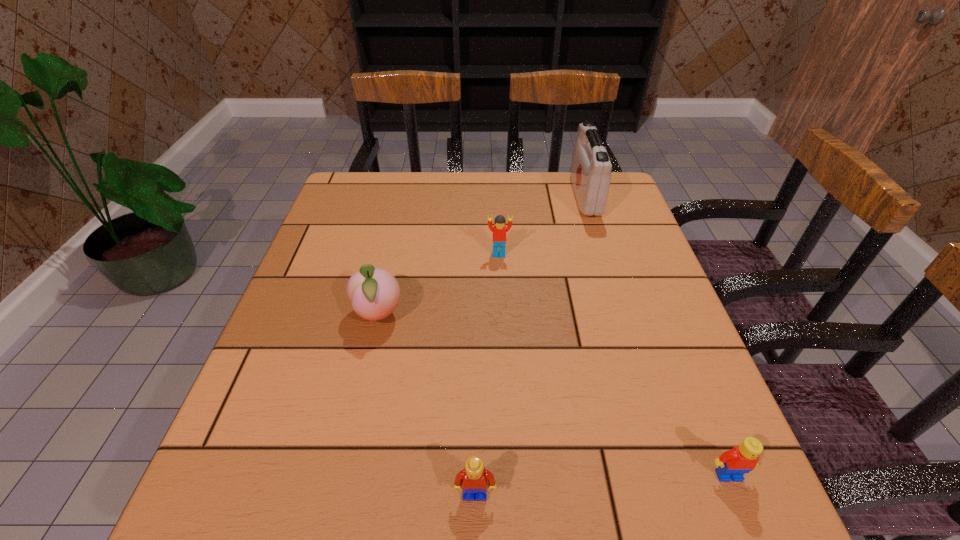
The width and height of the screenshot is (960, 540). What are the coordinates of `vacant area that lies between the nearest Lego and the rightmost Lego` in the screenshot? It's located at (602, 484).

The width and height of the screenshot is (960, 540). Find the location of `unoccupied position between the second nearest Lego and the peach`. unoccupied position between the second nearest Lego and the peach is located at coordinates (553, 395).

Find the location of a particular element. The height and width of the screenshot is (540, 960). vacant area between the third farthest object and the nearest object is located at coordinates (426, 404).

Find the location of `unoccupied area between the leftmost object and the nearest Lego`. unoccupied area between the leftmost object and the nearest Lego is located at coordinates (426, 404).

Find the location of `free point between the nearest Lego and the third farthest object`. free point between the nearest Lego and the third farthest object is located at coordinates (426, 404).

Point out which object is positioned as the fourth nearest to the second farthest Lego. Please provide its 2D coordinates. Your answer should be formatted as a tuple, i.e. [(x, y)], where the tuple contains the x and y coordinates of a point satisfying the conditions above.

[(591, 168)]

Find the location of a particular element. This screenshot has width=960, height=540. object identified as the fourth closest to the nearest object is located at coordinates (591, 168).

At what (x,y) coordinates should I click in order to perform the action: click on the third closest Lego relative to the farthest object. Please return your answer as a coordinate pair (x, y). Looking at the image, I should click on (474, 478).

Point out which Lego is positioned as the nearest to the farthest Lego. Please provide its 2D coordinates. Your answer should be formatted as a tuple, i.e. [(x, y)], where the tuple contains the x and y coordinates of a point satisfying the conditions above.

[(474, 478)]

At what (x,y) coordinates should I click in order to perform the action: click on vacant space that satisfies the following two spatial constraints: 1. on the front side of the first-aid kit; 2. on the face of the second farthest object. Please return your answer as a coordinate pair (x, y). This screenshot has height=540, width=960. Looking at the image, I should click on (603, 254).